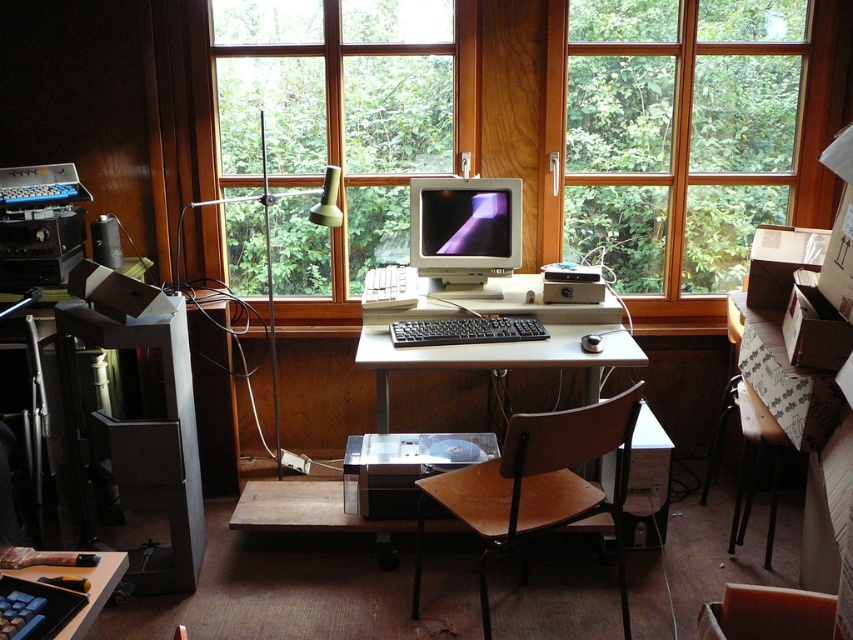
You are navigating a small robot through the workspace shown in the image. The robot is currently at the point labeled point (x=378, y=456). You need to move it to the point labeled point (x=90, y=579). Is the destination point in front of or behind your current position?

The destination point labeled point (x=90, y=579) is in front of your current position at point (x=378, y=456) because the Objects Description states that point (x=378, y=456) is behind point (x=90, y=579).

You are standing in the workspace and want to place a new item between the two points, point (506, 444) and point (80, 611). Which point is closer to you so you can start placing the item from there?

Point (506, 444) is closer to you than point (80, 611) because it is further to the viewer, so you should start placing the item from point (506, 444).

You are sitting in the brown wood swivel chair at center and want to reach the black plastic keyboard at lower left. Based on the scene description, can you easily reach the keyboard without moving your chair?

The brown wood swivel chair at center is located below the black plastic keyboard at lower left, which means the keyboard is positioned lower than the chair. However, since the keyboard is at lower left, it is likely within arm s reach from the chair, so yes, you can easily reach the black plastic keyboard at lower left without moving your chair.